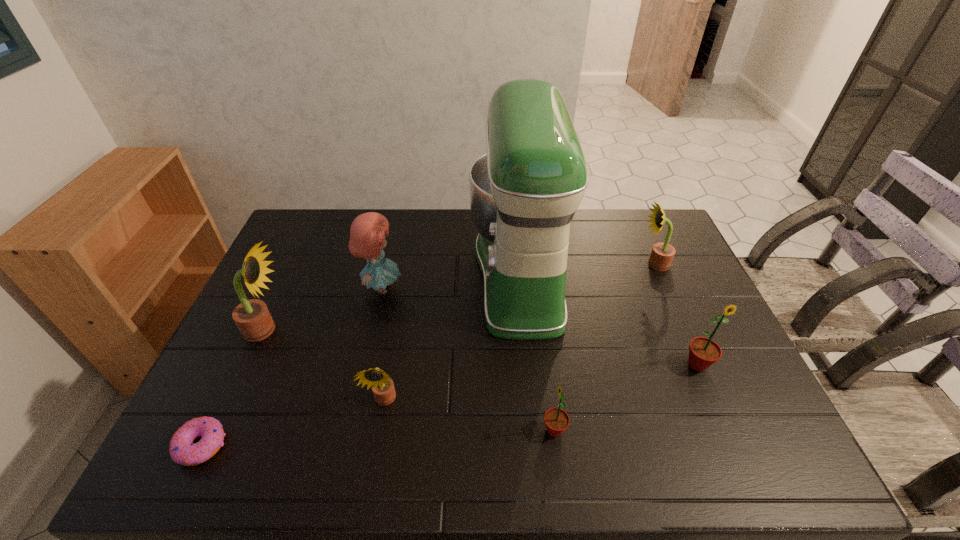
At what (x,y) coordinates should I click in order to perform the action: click on sunflower present at the near edge. Please return your answer as a coordinate pair (x, y). Image resolution: width=960 pixels, height=540 pixels. Looking at the image, I should click on (556, 420).

Identify the location of doughnut that is at the near edge. (183, 451).

In order to click on sunflower that is at the left edge in this screenshot , I will do [252, 317].

Image resolution: width=960 pixels, height=540 pixels. Identify the location of doughnut situated at the left edge. (183, 451).

In order to click on object located at the near left corner in this screenshot , I will do `click(183, 451)`.

The height and width of the screenshot is (540, 960). I want to click on vacant space at the far edge, so click(x=582, y=217).

In the image, there is a desktop. Identify the location of free region at the near edge. This screenshot has width=960, height=540. (705, 456).

Identify the location of free space at the left edge of the desktop. (319, 258).

Locate an element on the screen. The width and height of the screenshot is (960, 540). free space at the right edge is located at coordinates (680, 262).

The height and width of the screenshot is (540, 960). In the image, there is a desktop. Identify the location of vacant space at the far right corner. (628, 225).